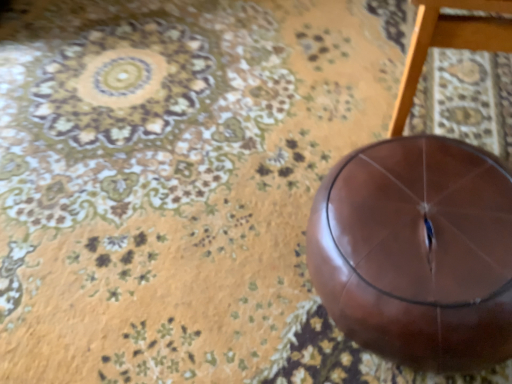
Question: In the image, is glossy leather ball at center on the left side or the right side of glossy brown stool at center?

Choices:
 (A) right
 (B) left

Answer: (B)

Question: Is point click(333, 289) positioned closer to the camera than point click(433, 11)?

Choices:
 (A) closer
 (B) farther

Answer: (B)

Question: From the image's perspective, relative to glossy brown stool at center, is glossy leather ball at center above or below?

Choices:
 (A) below
 (B) above

Answer: (A)

Question: From the image's perspective, is glossy brown stool at center positioned above or below glossy leather ball at center?

Choices:
 (A) above
 (B) below

Answer: (A)

Question: Considering the positions of point (396, 117) and point (488, 165), is point (396, 117) closer or farther from the camera than point (488, 165)?

Choices:
 (A) closer
 (B) farther

Answer: (B)

Question: Choose the correct answer: Is glossy brown stool at center inside glossy leather ball at center or outside it?

Choices:
 (A) outside
 (B) inside

Answer: (A)

Question: Considering their positions, is glossy brown stool at center located in front of or behind glossy leather ball at center?

Choices:
 (A) behind
 (B) front

Answer: (B)